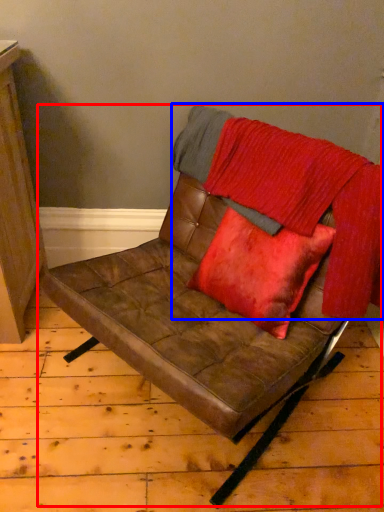
Question: Among these objects, which one is nearest to the camera, chair (highlighted by a red box) or blanket (highlighted by a blue box)?

Choices:
 (A) chair
 (B) blanket

Answer: (A)